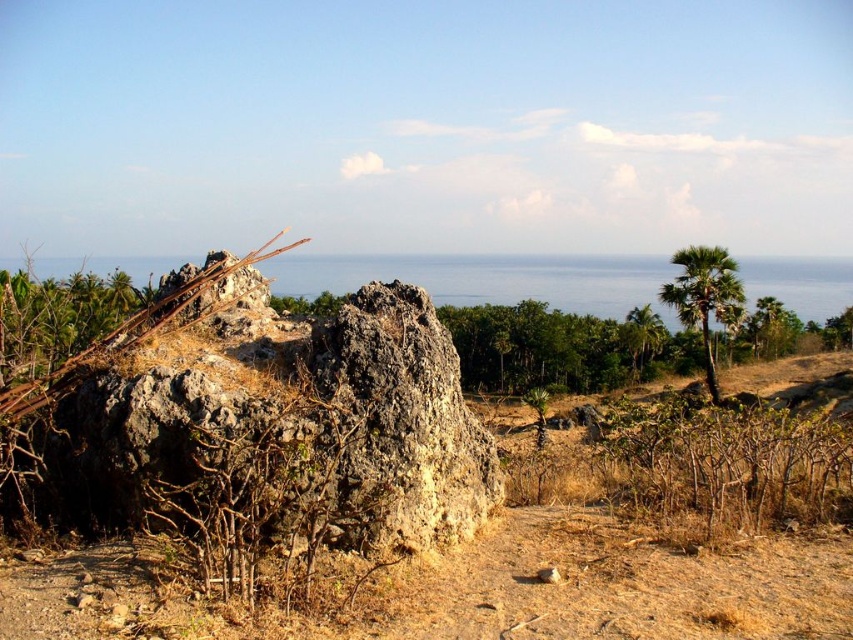
You are standing at the origin point in the image. There are two points marked in the scene. Which point is closer to you, point (654, 344) or point (680, 300)?

Point (680, 300) is closer to you because it is in front of point (654, 344).

You are standing at the point with coordinates point (654,330) and want to walk to the point (245,384). According to the scene description, which direction should you move to reach your destination?

You should move forward because point (245,384) is in front of point (654,330) according to the scene description.

You are a hiker who wants to reach the green leafy palm tree at upper right from your current position near the gray rough rock at center. The path between them is rocky and uneven. If your average walking speed is 1.5 meters per second, how many seconds will it take you to walk directly to the tree?

The distance between the gray rough rock at center and the green leafy palm tree at upper right is 43.08 meters. At a speed of 1.5 meters per second, the time required is 43.08 divided by 1.5, which equals approximately 28.72 seconds. Therefore, it will take roughly 29 seconds to reach the tree.